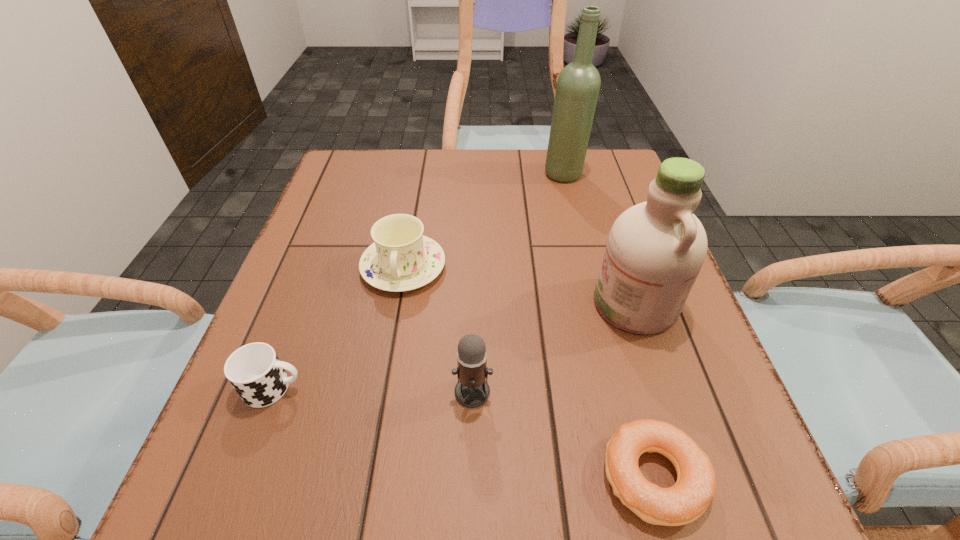
I want to click on free space at the left edge of the desktop, so click(x=325, y=377).

This screenshot has width=960, height=540. In the image, there is a desktop. Identify the location of vacant space at the right edge. (645, 383).

At what (x,y) coordinates should I click in order to perform the action: click on free spot at the far left corner of the desktop. Please return your answer as a coordinate pair (x, y). This screenshot has height=540, width=960. Looking at the image, I should click on (333, 165).

Locate an element on the screen. This screenshot has width=960, height=540. free space at the far right corner of the desktop is located at coordinates (589, 189).

You are a GUI agent. You are given a task and a screenshot of the screen. Output one action in this format:
    pyautogui.click(x=<x>, y=<y>)
    Task: Click on the empty space between the cleansing agent and the leftmost object
    Image resolution: width=960 pixels, height=540 pixels.
    Given the screenshot: What is the action you would take?
    [454, 346]

Identify the location of vacant space that is in between the third object from left to right and the third shortest object. This screenshot has height=540, width=960. (438, 329).

Where is `free space between the farthest object and the chinaware`? The image size is (960, 540). free space between the farthest object and the chinaware is located at coordinates (484, 220).

At what (x,y) coordinates should I click in order to perform the action: click on free space between the cleansing agent and the wine bottle. Please return your answer as a coordinate pair (x, y). The image size is (960, 540). Looking at the image, I should click on (599, 239).

I want to click on free space between the second object from left to right and the third tallest object, so click(x=438, y=329).

The image size is (960, 540). In order to click on vacant area that lies between the bagel and the microphone in this screenshot , I will do `click(564, 434)`.